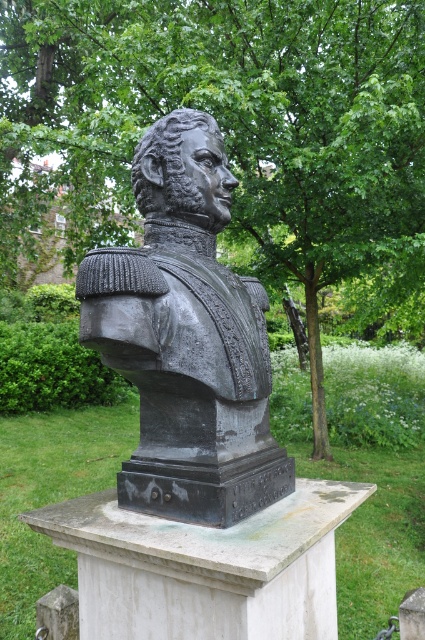
Question: Among these objects, which one is nearest to the camera?

Choices:
 (A) green leafy tree at center
 (B) black polished bust at center

Answer: (B)

Question: Which point is farther to the camera?

Choices:
 (A) green leafy tree at center
 (B) black polished bust at center

Answer: (A)

Question: Is the position of green leafy tree at center less distant than that of black polished bust at center?

Choices:
 (A) yes
 (B) no

Answer: (B)

Question: Which point is closer to the camera?

Choices:
 (A) (153, 148)
 (B) (20, 132)

Answer: (A)

Question: Can you confirm if green leafy tree at center is positioned above black polished bust at center?

Choices:
 (A) yes
 (B) no

Answer: (A)

Question: Can you confirm if green leafy tree at center is positioned to the left of black polished bust at center?

Choices:
 (A) yes
 (B) no

Answer: (B)